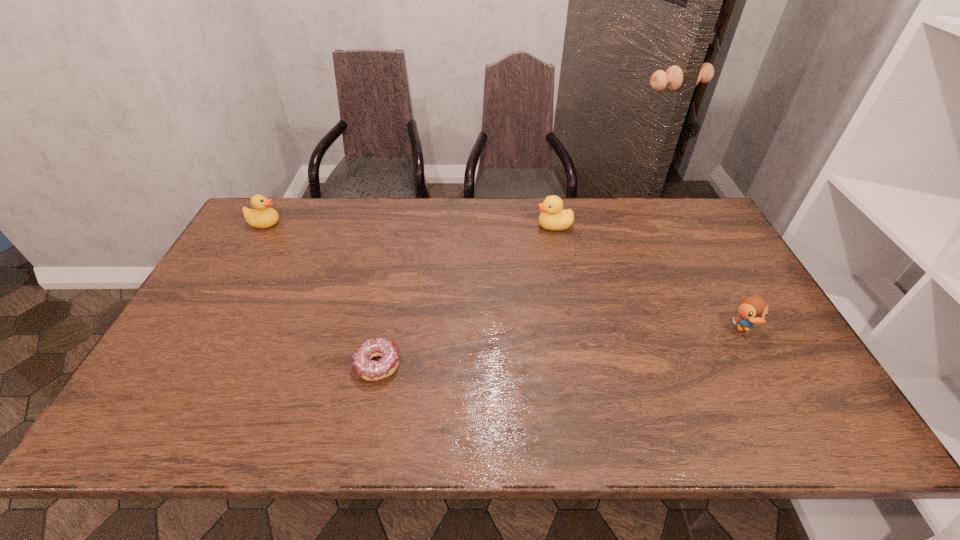
Where is `the leftmost object`? The image size is (960, 540). the leftmost object is located at coordinates (263, 216).

At what (x,y) coordinates should I click in order to perform the action: click on the second duck from left to right. Please return your answer as a coordinate pair (x, y). This screenshot has height=540, width=960. Looking at the image, I should click on (553, 218).

Locate an element on the screen. The width and height of the screenshot is (960, 540). the second nearest object is located at coordinates (752, 309).

Identify the location of the rightmost duck. Image resolution: width=960 pixels, height=540 pixels. (752, 309).

Find the location of `the nearest object`. the nearest object is located at coordinates (372, 370).

In order to click on the shortest object in this screenshot , I will do click(x=372, y=370).

At what (x,y) coordinates should I click in order to perform the action: click on vacant area situated 0.260m at the beak of the leftmost object. Please return your answer as a coordinate pair (x, y). This screenshot has height=540, width=960. Looking at the image, I should click on (358, 224).

Identify the location of vacant area located at the beak of the second object from right to left. (473, 225).

Where is `free location located at the beak of the second object from right to left`? This screenshot has width=960, height=540. free location located at the beak of the second object from right to left is located at coordinates (444, 225).

Where is `vacant space located at the beak of the second object from right to left`? The height and width of the screenshot is (540, 960). vacant space located at the beak of the second object from right to left is located at coordinates click(476, 225).